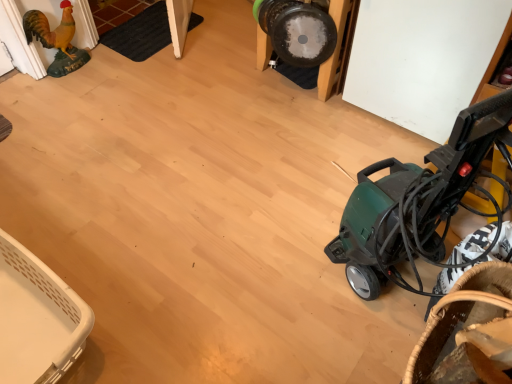
The width and height of the screenshot is (512, 384). What are the coordinates of `free space in front of golden matte chicken at left` in the screenshot? It's located at (58, 92).